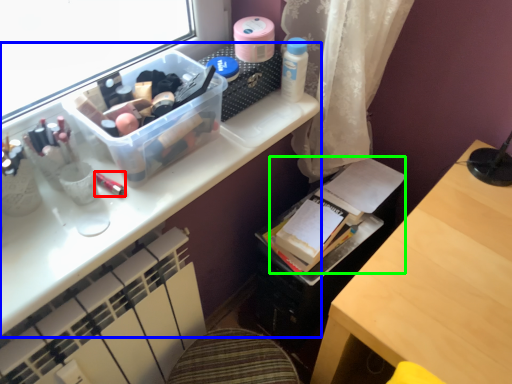
Question: Estimate the real-world distances between objects in this image. Which object is farther from toiletry (highlighted by a red box), desk (highlighted by a blue box) or book (highlighted by a green box)?

Choices:
 (A) desk
 (B) book

Answer: (B)